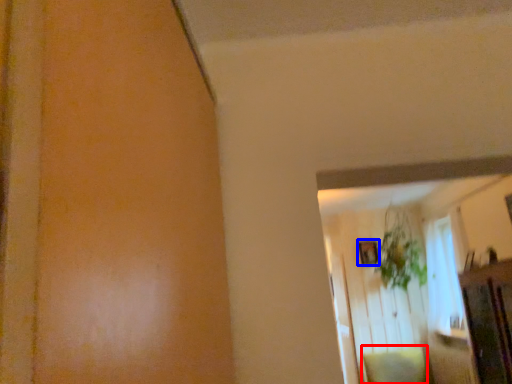
Question: Which point is further to the camera, pillow (highlighted by a red box) or picture frame (highlighted by a blue box)?

Choices:
 (A) pillow
 (B) picture frame

Answer: (B)